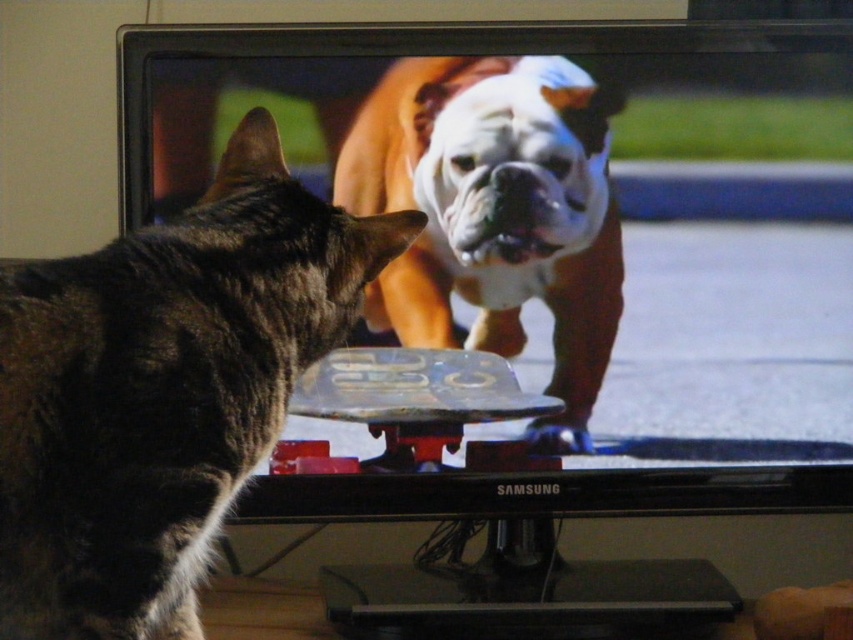
From the picture: Is dark brown fur cat at left below white fur dog at center?

Indeed, dark brown fur cat at left is positioned under white fur dog at center.

From the picture: Can you confirm if dark brown fur cat at left is wider than white fur dog at center?

No.

You are a GUI agent. You are given a task and a screenshot of the screen. Output one action in this format:
    pyautogui.click(x=<x>, y=<y>)
    Task: Click on the dark brown fur cat at left
    
    Given the screenshot: What is the action you would take?
    click(x=163, y=388)

The width and height of the screenshot is (853, 640). Find the location of `dark brown fur cat at left`. dark brown fur cat at left is located at coordinates (163, 388).